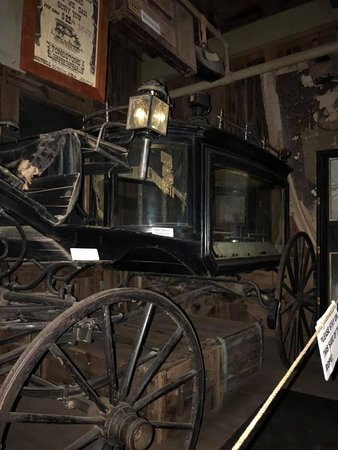
Where is `wooden ground`? wooden ground is located at coordinates (239, 413).